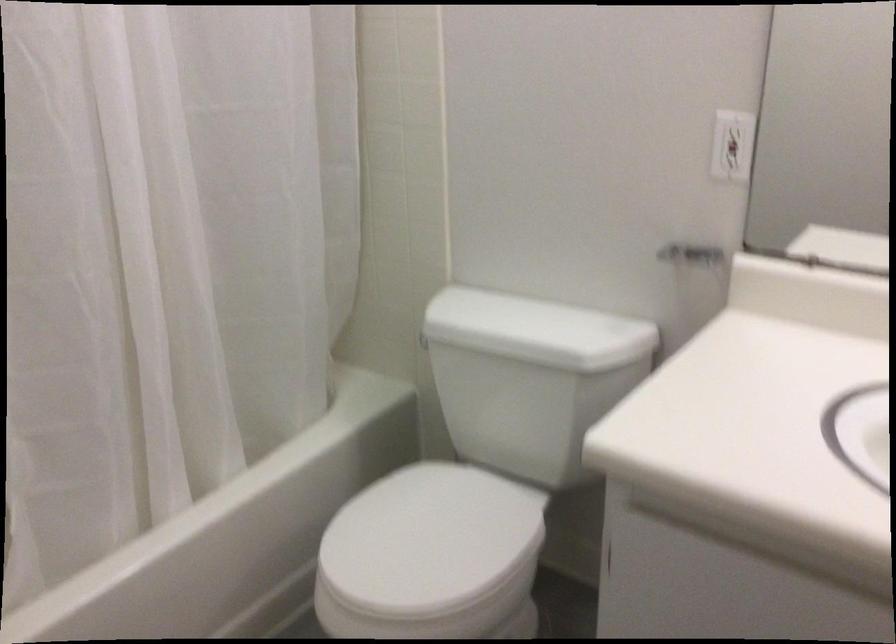
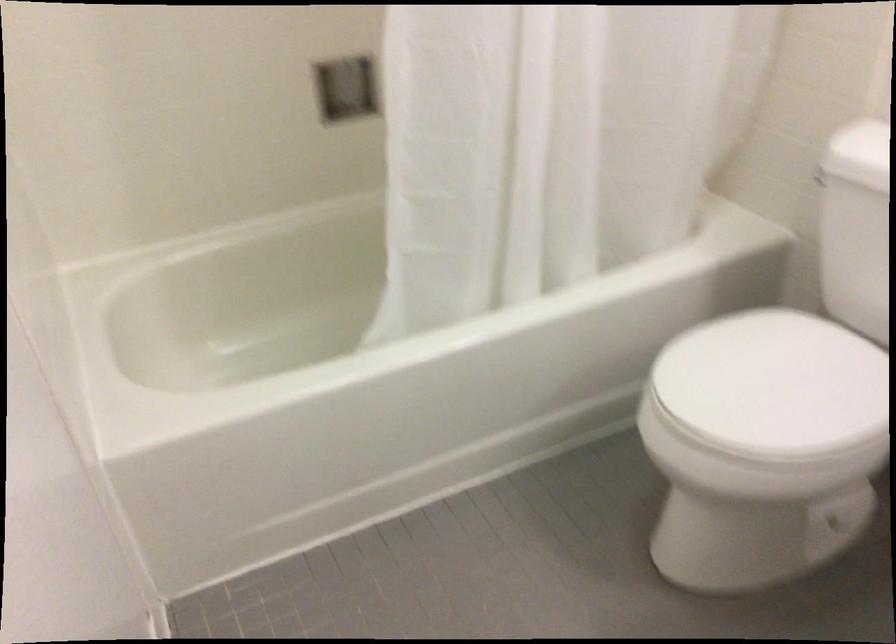
Which direction would the cameraman need to move to produce the second image?

The cameraman walked toward left, forward.